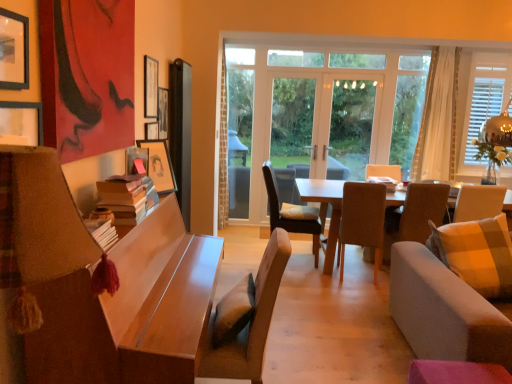
What is the approximate height of white sheer curtain at right?

1.71 meters.

Where is `wooden table at center, which is counted as the 1th table, starting from the right`? wooden table at center, which is counted as the 1th table, starting from the right is located at coordinates (325, 209).

What do you see at coordinates (325, 209) in the screenshot? I see `wooden table at center, which is counted as the second table, starting from the left` at bounding box center [325, 209].

The image size is (512, 384). Identify the location of wooden picture frame at upper center, placed as the 3th picture frame when sorted from front to back. (150, 87).

What do you see at coordinates (408, 111) in the screenshot?
I see `transparent glass window at center, the second window positioned from the right` at bounding box center [408, 111].

Where is `transparent glass window at center, the 1th window viewed from the left`? This screenshot has height=384, width=512. transparent glass window at center, the 1th window viewed from the left is located at coordinates [408, 111].

This screenshot has height=384, width=512. Find the location of `wooden picture frame at upper center, which ranks as the 1th picture frame in back-to-front order`. wooden picture frame at upper center, which ranks as the 1th picture frame in back-to-front order is located at coordinates (163, 112).

Looking at this image, measure the distance between matte wooden picture frame at upper left, the second picture frame when ordered from front to back, and camera.

A distance of 6.82 feet exists between matte wooden picture frame at upper left, the second picture frame when ordered from front to back, and camera.

Looking at this image, what is the approximate height of matte wooden picture frame at upper left, marked as the third picture frame in a back-to-front arrangement?

6.34 inches.

This screenshot has height=384, width=512. Describe the element at coordinates (298, 212) in the screenshot. I see `soft yellow pillow at center` at that location.

What are the coordinates of `white sheer curtain at right` in the screenshot? It's located at click(438, 118).

Considering the relative sizes of wooden table at center, the 1th screen door when ordered from right to left, and wooden picture frame at upper center, which ranks as the 1th picture frame in back-to-front order, in the image provided, is wooden table at center, the 1th screen door when ordered from right to left, bigger than wooden picture frame at upper center, which ranks as the 1th picture frame in back-to-front order,?

Correct, wooden table at center, the 1th screen door when ordered from right to left, is larger in size than wooden picture frame at upper center, which ranks as the 1th picture frame in back-to-front order.

Which is more to the left, wooden table at center, which is counted as the 2th screen door, starting from the left, or wooden picture frame at upper center, positioned as the fourth picture frame in front-to-back order?

wooden picture frame at upper center, positioned as the fourth picture frame in front-to-back order, is more to the left.

At what (x,y) coordinates should I click in order to perform the action: click on the 2nd screen door counting from the right side of the wooden picture frame at upper center, which ranks as the 1th picture frame in back-to-front order. Please return your answer as a coordinate pair (x, y). Looking at the image, I should click on (320, 129).

In the scene shown: Considering the relative sizes of wooden table at center, the 1th screen door when ordered from right to left, and wooden picture frame at upper center, which ranks as the 1th picture frame in back-to-front order, in the image provided, is wooden table at center, the 1th screen door when ordered from right to left, wider than wooden picture frame at upper center, which ranks as the 1th picture frame in back-to-front order,?

Yes.

Can you confirm if wooden picture frame at upper center, which ranks as the 1th picture frame in back-to-front order, is bigger than brown fabric chair at center, arranged as the 3th chair when viewed from the right?

Actually, wooden picture frame at upper center, which ranks as the 1th picture frame in back-to-front order, might be smaller than brown fabric chair at center, arranged as the 3th chair when viewed from the right.

Does wooden picture frame at upper center, positioned as the fourth picture frame in front-to-back order, have a lesser height compared to brown fabric chair at center, which is the first chair in back-to-front order?

Yes, wooden picture frame at upper center, positioned as the fourth picture frame in front-to-back order, is shorter than brown fabric chair at center, which is the first chair in back-to-front order.

From a real-world perspective, between wooden picture frame at upper center, which ranks as the 1th picture frame in back-to-front order, and brown fabric chair at center, which is the first chair in back-to-front order, who is vertically lower?

brown fabric chair at center, which is the first chair in back-to-front order.

Are transparent glass door at center, acting as the 2th screen door starting from the right, and light gray fabric couch at right making contact?

transparent glass door at center, acting as the 2th screen door starting from the right, and light gray fabric couch at right are not in contact.

Would you say transparent glass door at center, the 1th screen door when ordered from left to right, contains light gray fabric couch at right?

That's incorrect, light gray fabric couch at right is not inside transparent glass door at center, the 1th screen door when ordered from left to right.

Between transparent glass door at center, the 1th screen door when ordered from left to right, and light gray fabric couch at right, which one appears on the left side from the viewer's perspective?

transparent glass door at center, the 1th screen door when ordered from left to right, is more to the left.

From the image's perspective, between transparent glass door at center, acting as the 2th screen door starting from the right, and light gray fabric couch at right, which one is located above?

transparent glass door at center, acting as the 2th screen door starting from the right, from the image's perspective.

Considering the sizes of objects soft yellow pillow at center and light beige fabric chair at right, which is the second chair from back to front, in the image provided, who is bigger, soft yellow pillow at center or light beige fabric chair at right, which is the second chair from back to front,?

Bigger between the two is light beige fabric chair at right, which is the second chair from back to front.

Does soft yellow pillow at center touch light beige fabric chair at right, the third chair from the front?

No, soft yellow pillow at center is not beside light beige fabric chair at right, the third chair from the front.

Looking at this image, how different are the orientations of soft yellow pillow at center and light beige fabric chair at right, which is the second chair from back to front, in degrees?

There is a 96.7-degree angle between the facing directions of soft yellow pillow at center and light beige fabric chair at right, which is the second chair from back to front.

From the picture: Based on their positions, is brown fabric chair at center, which is the first chair in back-to-front order, located to the left or right of transparent glass door at center, acting as the 2th screen door starting from the right?

Based on their positions, brown fabric chair at center, which is the first chair in back-to-front order, is located to the left of transparent glass door at center, acting as the 2th screen door starting from the right.

In terms of height, does brown fabric chair at center, arranged as the 3th chair when viewed from the right, look taller or shorter compared to transparent glass door at center, acting as the 2th screen door starting from the right?

In the image, brown fabric chair at center, arranged as the 3th chair when viewed from the right, appears to be shorter than transparent glass door at center, acting as the 2th screen door starting from the right.

Is transparent glass door at center, acting as the 2th screen door starting from the right, at the back of brown fabric chair at center, which is counted as the 2th chair, starting from the left?

No, brown fabric chair at center, which is counted as the 2th chair, starting from the left,'s orientation is not away from transparent glass door at center, acting as the 2th screen door starting from the right.

Does point (281, 225) come closer to viewer compared to point (305, 98)?

Yes, it is in front of point (305, 98).

In the image, is wooden table at center, the 1th screen door when ordered from right to left, on the left side or the right side of wooden picture frame at upper center, marked as the second picture frame in a back-to-front arrangement?

Based on their positions, wooden table at center, the 1th screen door when ordered from right to left, is located to the right of wooden picture frame at upper center, marked as the second picture frame in a back-to-front arrangement.

From their relative heights in the image, would you say wooden table at center, which is counted as the 2th screen door, starting from the left, is taller or shorter than wooden picture frame at upper center, marked as the second picture frame in a back-to-front arrangement?

Considering their sizes, wooden table at center, which is counted as the 2th screen door, starting from the left, has more height than wooden picture frame at upper center, marked as the second picture frame in a back-to-front arrangement.

How distant is wooden table at center, the 1th screen door when ordered from right to left, from wooden picture frame at upper center, placed as the 3th picture frame when sorted from front to back?

wooden table at center, the 1th screen door when ordered from right to left, and wooden picture frame at upper center, placed as the 3th picture frame when sorted from front to back, are 9.25 feet apart from each other.

Is wooden table at center, the 1th screen door when ordered from right to left, outside of transparent glass door at center, acting as the 2th screen door starting from the right?

Answer: wooden table at center, the 1th screen door when ordered from right to left, lies outside transparent glass door at center, acting as the 2th screen door starting from the right,'s area.

Is wooden table at center, which is counted as the 2th screen door, starting from the left, positioned with its back to transparent glass door at center, acting as the 2th screen door starting from the right?

That's right, wooden table at center, which is counted as the 2th screen door, starting from the left, is facing away from transparent glass door at center, acting as the 2th screen door starting from the right.

Considering the relative sizes of wooden table at center, the 1th screen door when ordered from right to left, and transparent glass door at center, acting as the 2th screen door starting from the right, in the image provided, is wooden table at center, the 1th screen door when ordered from right to left, wider than transparent glass door at center, acting as the 2th screen door starting from the right,?

Correct, the width of wooden table at center, the 1th screen door when ordered from right to left, exceeds that of transparent glass door at center, acting as the 2th screen door starting from the right.

The height and width of the screenshot is (384, 512). Identify the location of picture frame that is the 2nd object above the wooden table at center, which is counted as the 2th screen door, starting from the left (from a real-world perspective). (163, 112).

There is a wooden picture frame at upper center, positioned as the fourth picture frame in front-to-back order. Find the location of `the 2nd chair below it (from a real-world perspective)`. the 2nd chair below it (from a real-world perspective) is located at coordinates (285, 218).

Looking at the image, which one is located closer to light gray fabric couch at right, brown fabric chair at center, arranged as the 3th chair when viewed from the right, or transparent glass door at center, acting as the 2th screen door starting from the right?

brown fabric chair at center, arranged as the 3th chair when viewed from the right, lies closer to light gray fabric couch at right than the other object.

Looking at the image, which one is located further to transparent glass door at center, the 1th screen door when ordered from left to right, wooden table at center, which is counted as the second table, starting from the left, or black matte picture frame at upper left, which appears as the first picture frame when viewed from the front?

black matte picture frame at upper left, which appears as the first picture frame when viewed from the front, is further to transparent glass door at center, the 1th screen door when ordered from left to right.

Which object lies further to the anchor point light gray fabric couch at right, light brown fabric chair at center, the fourth chair in the right-to-left sequence, or wooden table at center, the 2th table from the front?

wooden table at center, the 2th table from the front.

Estimate the real-world distances between objects in this image. Which object is closer to transparent glass door at center, the 1th screen door when ordered from left to right, light beige fabric chair at right, the third chair from the front, or white sheer curtain at right?

white sheer curtain at right is closer to transparent glass door at center, the 1th screen door when ordered from left to right.

Which object lies nearer to the anchor point wooden table at left, which is counted as the second table, starting from the back, transparent glass window at center, the 1th window viewed from the left, or black matte picture frame at upper left, which appears as the first picture frame when viewed from the front?

black matte picture frame at upper left, which appears as the first picture frame when viewed from the front, lies closer to wooden table at left, which is counted as the second table, starting from the back, than the other object.

When comparing their distances from transparent glass window at center, the 1th window viewed from the left, does soft yellow pillow at center or light gray fabric couch at right seem closer?

soft yellow pillow at center lies closer to transparent glass window at center, the 1th window viewed from the left, than the other object.

Which object lies further to the anchor point white wooden window at right, which ranks as the first window in right-to-left order, transparent glass window at center, the 1th window viewed from the left, or wooden table at center, which is counted as the 1th table, starting from the right?

wooden table at center, which is counted as the 1th table, starting from the right, is further to white wooden window at right, which ranks as the first window in right-to-left order.

Considering their positions, is light beige fabric chair at right, the third chair from the front, positioned further to matte wooden picture frame at upper left, the second picture frame when ordered from front to back, than white sheer curtain at right?

white sheer curtain at right lies further to matte wooden picture frame at upper left, the second picture frame when ordered from front to back, than the other object.

Locate an element on the screen. The width and height of the screenshot is (512, 384). curtain located between black matte picture frame at upper left, arranged as the 4th picture frame when viewed from the back, and transparent glass window at center, the second window positioned from the right, in the depth direction is located at coordinates (438, 118).

Identify the location of pillow between wooden picture frame at upper center, marked as the second picture frame in a back-to-front arrangement, and light beige fabric chair at right, the 1th chair when ordered from right to left. The height and width of the screenshot is (384, 512). (298, 212).

This screenshot has width=512, height=384. In order to click on chair between beige fabric chair at center, which is counted as the 2th chair, starting from the front, and white wooden window at right, arranged as the second window when viewed from the left, in the horizontal direction in this screenshot , I will do `click(415, 215)`.

Where is `picture frame between black matte picture frame at upper left, which appears as the first picture frame when viewed from the front, and wooden table at left, which is counted as the second table, starting from the back, in the up-down direction`? picture frame between black matte picture frame at upper left, which appears as the first picture frame when viewed from the front, and wooden table at left, which is counted as the second table, starting from the back, in the up-down direction is located at coordinates (136, 157).